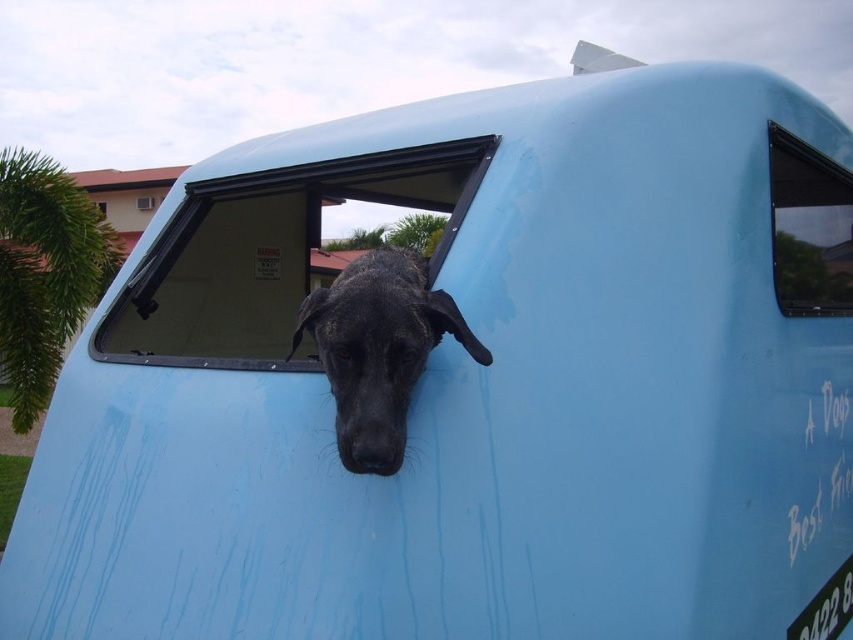
Looking at this image, can you confirm if black matte dog at center is positioned to the left of transparent glass window at upper right?

Yes, black matte dog at center is to the left of transparent glass window at upper right.

Does point (416, 369) come closer to viewer compared to point (833, 161)?

Yes, it is.

The image size is (853, 640). I want to click on black matte dog at center, so click(378, 349).

Does transparent glass window at upper center appear over transparent glass window at center?

Yes, transparent glass window at upper center is above transparent glass window at center.

Is transparent glass window at upper center wider than transparent glass window at center?

No.

Who is more distant from viewer, (146, 209) or (103, 205)?

Positioned behind is point (146, 209).

Identify the location of transparent glass window at upper center. Image resolution: width=853 pixels, height=640 pixels. (144, 202).

Could you measure the distance between transparent plastic window at center and transparent glass window at upper right?

transparent plastic window at center is 1.85 meters away from transparent glass window at upper right.

Does point (474, 182) come in front of point (778, 186)?

Yes, it is in front of point (778, 186).

Which is in front, point (271, 232) or point (793, 310)?

Point (793, 310) is more forward.

Where is `transparent plastic window at center`? The width and height of the screenshot is (853, 640). transparent plastic window at center is located at coordinates (x=265, y=252).